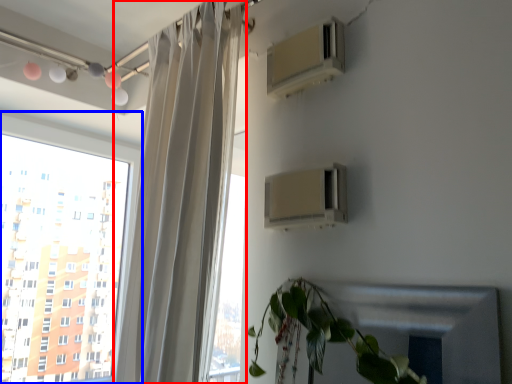
Question: Which of the following is the closest to the observer, curtain (highlighted by a red box) or window (highlighted by a blue box)?

Choices:
 (A) curtain
 (B) window

Answer: (A)